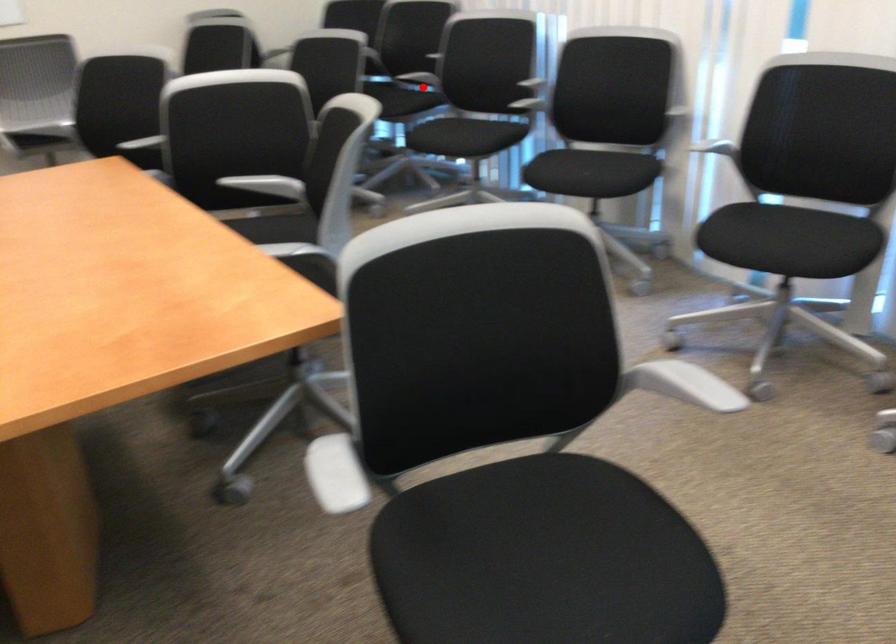
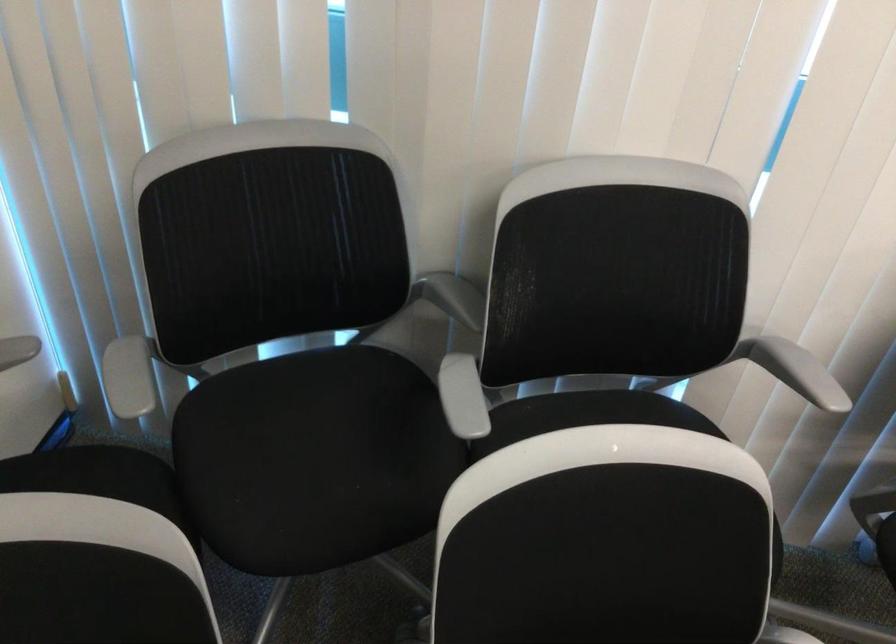
In the second image, find the point that corresponds to the highlighted location in the first image.

(605, 412)